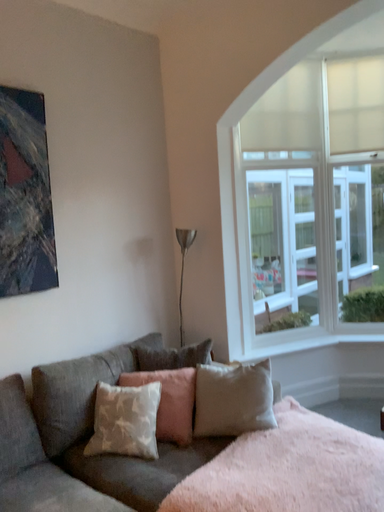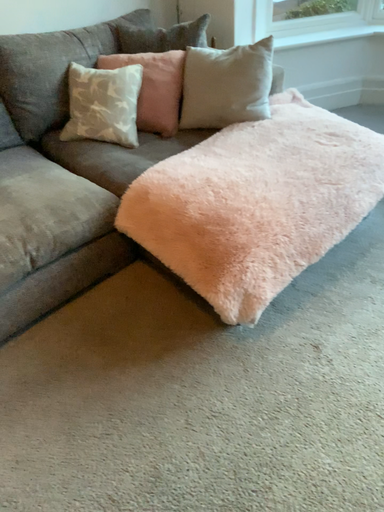
Question: How did the camera likely rotate when shooting the video?

Choices:
 (A) rotated upward
 (B) rotated downward

Answer: (B)